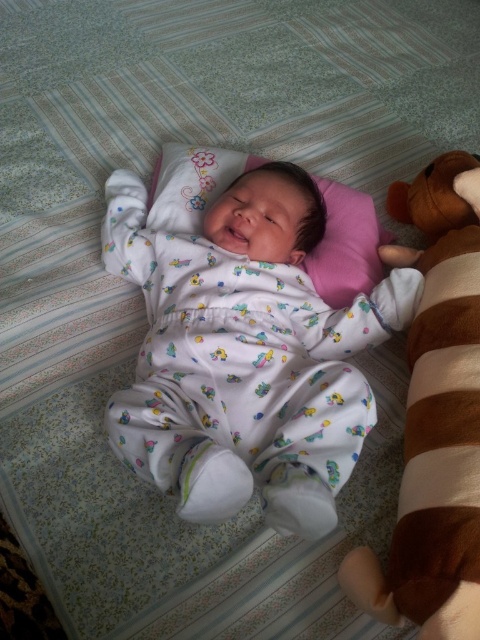
Is white cotton onesie at center bigger than brown plush bear at right?

Correct, white cotton onesie at center is larger in size than brown plush bear at right.

Is point (184, 394) closer to camera compared to point (356, 577)?

No, it is behind (356, 577).

Identify the location of white cotton onesie at center. (244, 353).

Is white cotton onesie at center below pink fabric pillow at center?

Yes, white cotton onesie at center is below pink fabric pillow at center.

Does point (350, 388) lie behind point (162, 160)?

No, (350, 388) is closer to viewer.

I want to click on white cotton onesie at center, so click(x=244, y=353).

Which is below, brown plush bear at right or pink fabric pillow at center?

brown plush bear at right

Can you confirm if brown plush bear at right is positioned to the right of pink fabric pillow at center?

Yes, brown plush bear at right is to the right of pink fabric pillow at center.

Who is more distant from viewer, (x=396, y=572) or (x=155, y=211)?

The point (x=155, y=211) is behind.

The width and height of the screenshot is (480, 640). Find the location of `brown plush bear at right`. brown plush bear at right is located at coordinates (435, 419).